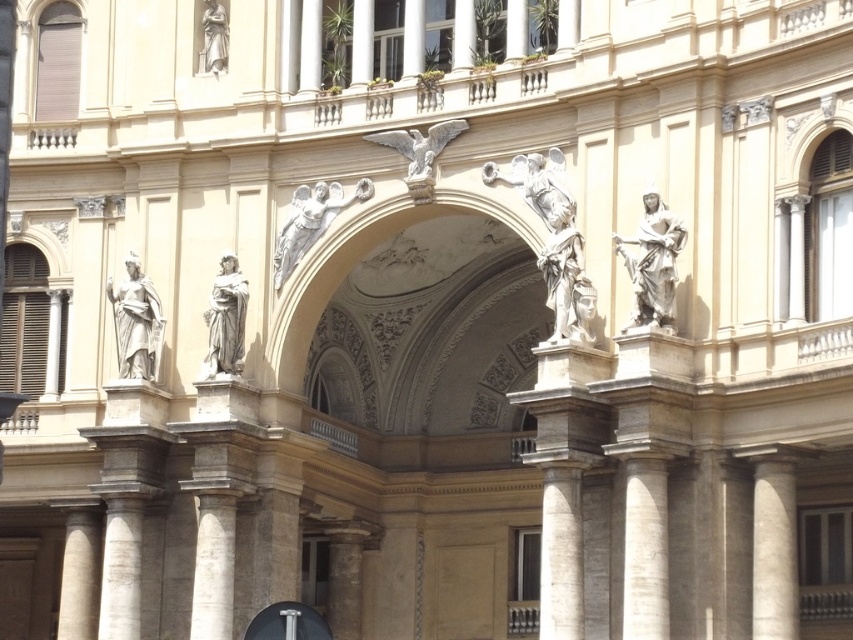
Between matte stone statue at left and white marble angel at center, which one has more height?

Standing taller between the two is matte stone statue at left.

This screenshot has height=640, width=853. I want to click on matte stone statue at left, so click(136, 323).

Find the location of a particular element. The image size is (853, 640). matte stone statue at left is located at coordinates (136, 323).

Is white marble statue at upper right positioned behind white marble statue at center?

No, it is in front of white marble statue at center.

Can you confirm if white marble statue at upper right is bigger than white marble statue at center?

Correct, white marble statue at upper right is larger in size than white marble statue at center.

Is point (646, 268) behind point (212, 291)?

No, (646, 268) is in front of (212, 291).

I want to click on white marble statue at upper right, so click(x=653, y=262).

Can you confirm if white marble statue at upper right is shorter than matte stone statue at left?

In fact, white marble statue at upper right may be taller than matte stone statue at left.

Does white marble statue at upper right have a smaller size compared to matte stone statue at left?

No, white marble statue at upper right is not smaller than matte stone statue at left.

What do you see at coordinates (653, 262) in the screenshot? I see `white marble statue at upper right` at bounding box center [653, 262].

Identify the location of white marble statue at upper right. (653, 262).